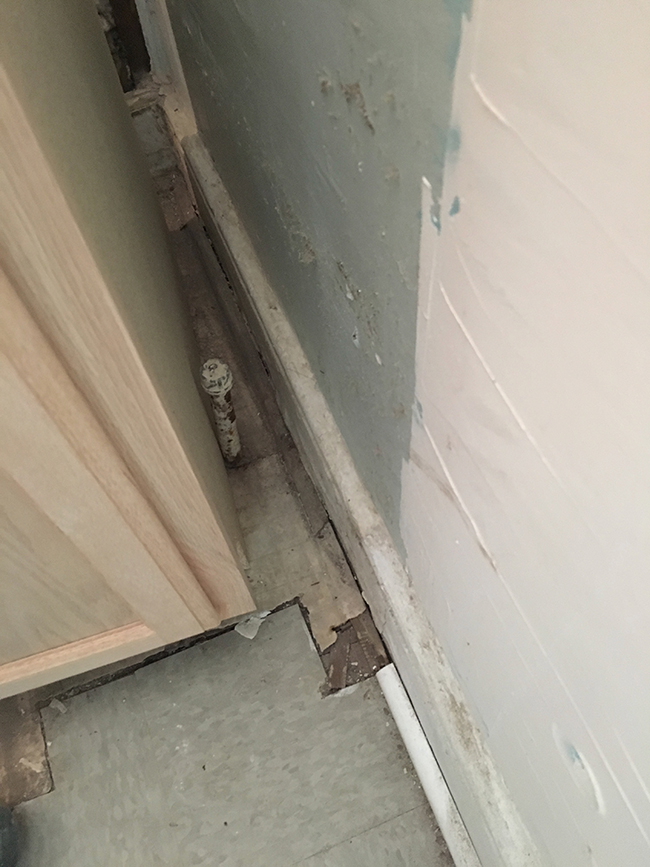
The height and width of the screenshot is (867, 650). I want to click on peeling paint on wall, so click(359, 99).